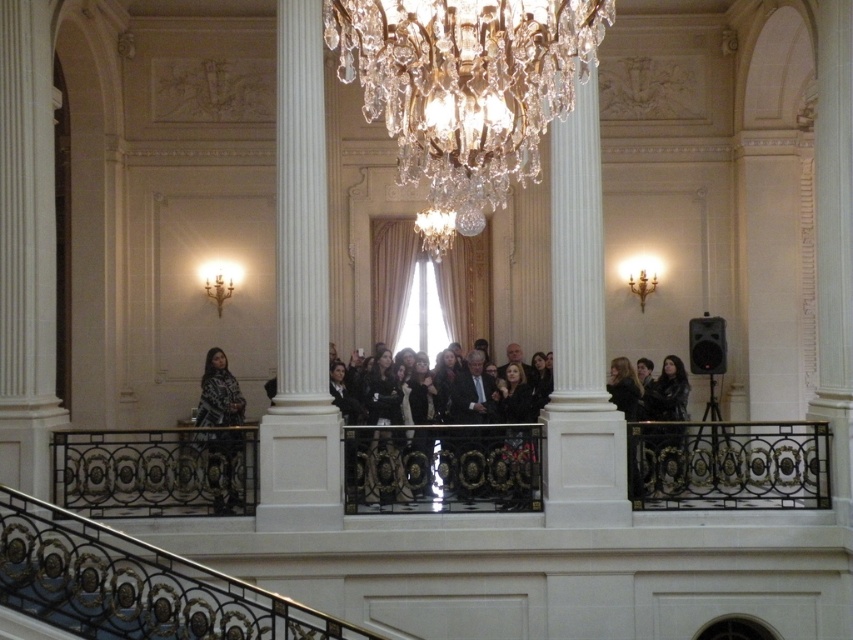
Does black leather jacket at center appear on the right side of patterned fabric shawl at upper left?

Indeed, black leather jacket at center is positioned on the right side of patterned fabric shawl at upper left.

Can you confirm if black leather jacket at center is positioned below patterned fabric shawl at upper left?

Yes.

Is point (358, 506) less distant than point (241, 464)?

No, (358, 506) is further to viewer.

This screenshot has width=853, height=640. Find the location of `black leather jacket at center`. black leather jacket at center is located at coordinates (450, 456).

Does crystal-golden chandelier at center appear over white smooth column at center?

Yes, crystal-golden chandelier at center is above white smooth column at center.

Does crystal-golden chandelier at center have a lesser width compared to white smooth column at center?

No, crystal-golden chandelier at center is not thinner than white smooth column at center.

I want to click on crystal-golden chandelier at center, so click(465, 90).

Which is more to the right, crystal-golden chandelier at center or patterned fabric shawl at upper left?

From the viewer's perspective, crystal-golden chandelier at center appears more on the right side.

Does crystal-golden chandelier at center come in front of patterned fabric shawl at upper left?

Yes, it is.

Who is more distant from viewer, (595, 49) or (212, 484)?

The point (212, 484) is behind.

The width and height of the screenshot is (853, 640). I want to click on crystal-golden chandelier at center, so click(x=465, y=90).